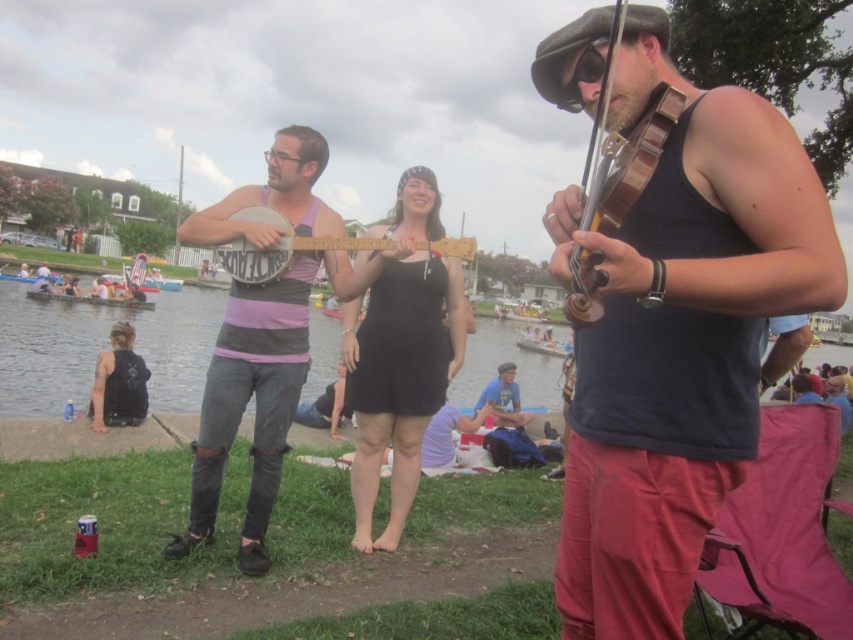
Question: Can you confirm if purple matte tank top at center is thinner than clear water at lower left?

Choices:
 (A) no
 (B) yes

Answer: (B)

Question: Estimate the real-world distances between objects in this image. Which object is farther from the clear water at lower left?

Choices:
 (A) wooden violin at right
 (B) blue t-shirt at center
 (C) purple matte tank top at center

Answer: (A)

Question: Which object appears farthest from the camera in this image?

Choices:
 (A) black matte tank top at lower left
 (B) wooden banjo at center
 (C) matte black tank top at center

Answer: (A)

Question: Which point is closer to the camera?

Choices:
 (A) black matte tank top at lower left
 (B) blue t-shirt at center
 (C) purple matte tank top at center
 (D) wooden violin at right

Answer: (D)

Question: From the image, what is the correct spatial relationship of black fabric dress at center in relation to blue t-shirt at center?

Choices:
 (A) right
 (B) left

Answer: (B)

Question: Does matte black tank top at center come in front of black fabric dress at center?

Choices:
 (A) no
 (B) yes

Answer: (B)